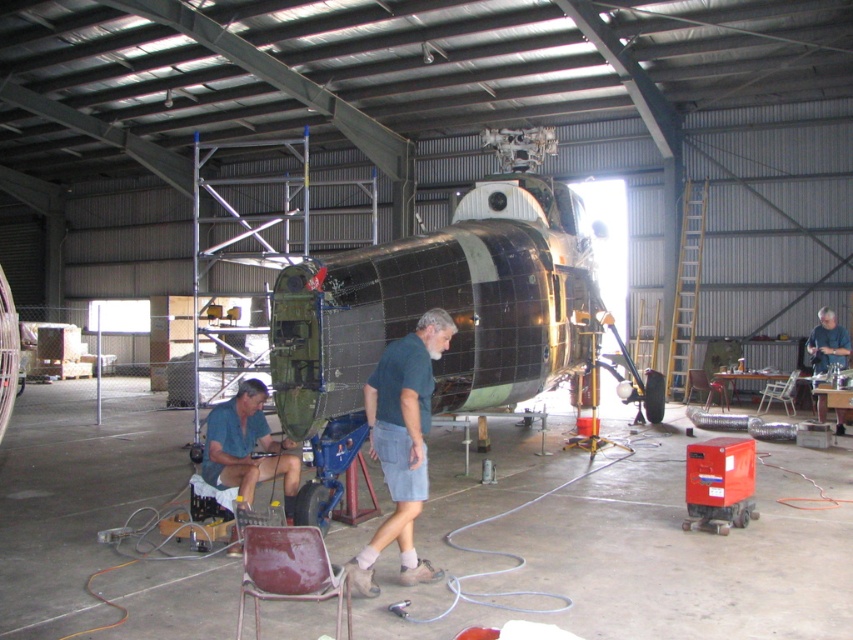
Is metallic maroon chair at lower center wider than brown leather chair at center?

Incorrect, metallic maroon chair at lower center's width does not surpass brown leather chair at center's.

Which is above, metallic maroon chair at lower center or brown leather chair at center?

brown leather chair at center is above.

Does point (258, 634) come in front of point (701, 387)?

Yes, point (258, 634) is in front of point (701, 387).

Identify the location of metallic maroon chair at lower center. The image size is (853, 640). (289, 572).

Which is behind, point (444, 349) or point (712, 385)?

Positioned behind is point (712, 385).

Where is `dark green shirt at center`? The image size is (853, 640). dark green shirt at center is located at coordinates (401, 444).

What do you see at coordinates (779, 394) in the screenshot? I see `metallic gray chair at center` at bounding box center [779, 394].

Image resolution: width=853 pixels, height=640 pixels. Describe the element at coordinates (779, 394) in the screenshot. I see `metallic gray chair at center` at that location.

You are a GUI agent. You are given a task and a screenshot of the screen. Output one action in this format:
    pyautogui.click(x=<x>, y=<y>)
    Task: Click on the metallic gray chair at center
    The width and height of the screenshot is (853, 640).
    Given the screenshot: What is the action you would take?
    pyautogui.click(x=779, y=394)